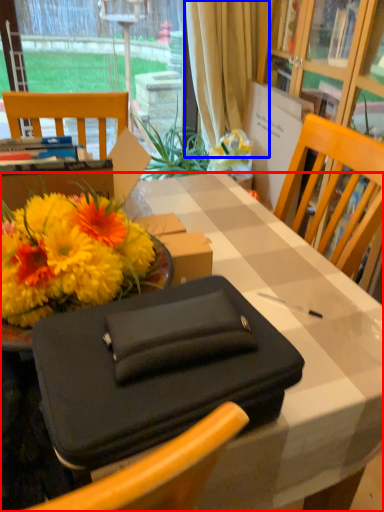
Question: Which object appears farthest to the camera in this image, desk (highlighted by a red box) or curtain (highlighted by a blue box)?

Choices:
 (A) desk
 (B) curtain

Answer: (B)